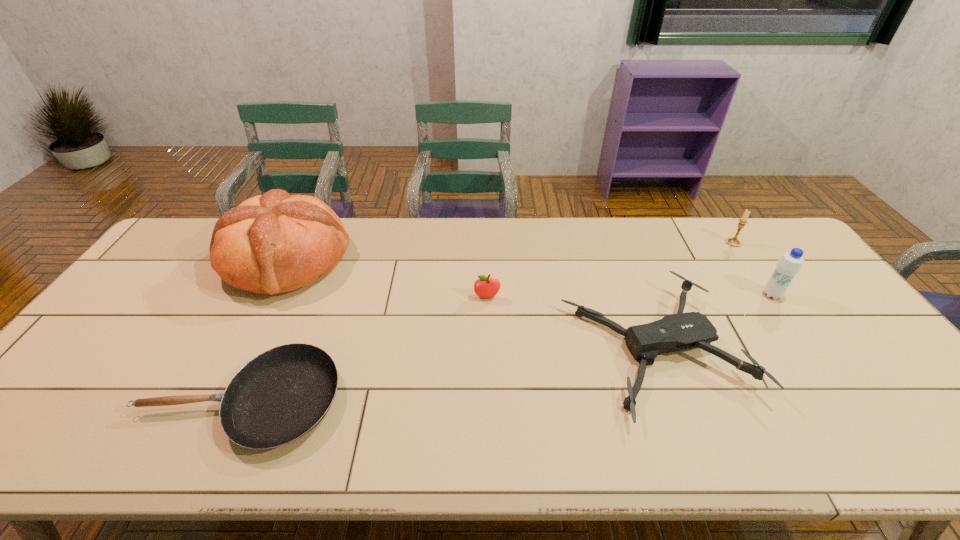
You are a GUI agent. You are given a task and a screenshot of the screen. Output one action in this format:
    pyautogui.click(x=<x>, y=<y>)
    Task: Click on the free region that satisfies the following two spatial constraints: 1. on the back side of the third object from left to right; 2. on the right side of the third tallest object
    
    Given the screenshot: What is the action you would take?
    pyautogui.click(x=486, y=242)

The image size is (960, 540). Identify the location of vacant point that satisfies the following two spatial constraints: 1. on the front side of the shortest object; 2. on the right side of the bread. (215, 401).

Where is `blank area in the image that satisfies the following two spatial constraints: 1. on the back side of the fifth shortest object; 2. on the left side of the drone`? The height and width of the screenshot is (540, 960). blank area in the image that satisfies the following two spatial constraints: 1. on the back side of the fifth shortest object; 2. on the left side of the drone is located at coordinates (634, 295).